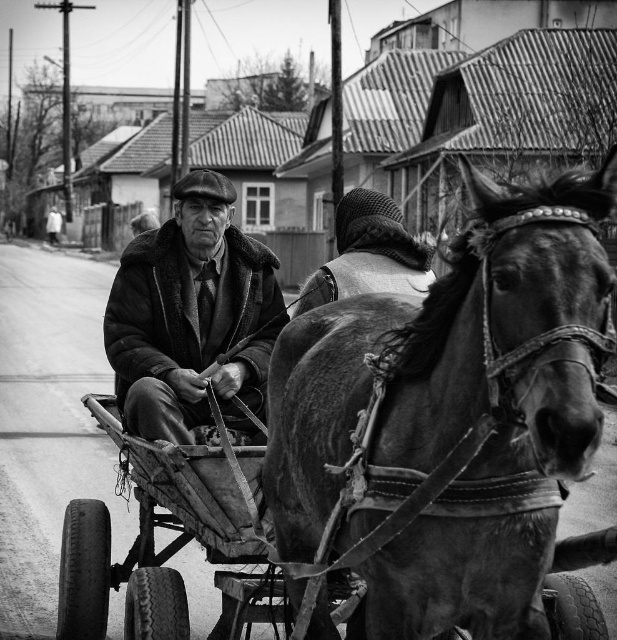
Question: Which point is closer to the camera?

Choices:
 (A) shiny dark brown horse at center
 (B) wooden cart at center
 (C) fur-lined coat at center

Answer: (A)

Question: Is wooden cart at center to the right of fur-lined coat at center from the viewer's perspective?

Choices:
 (A) yes
 (B) no

Answer: (B)

Question: Among these objects, which one is nearest to the camera?

Choices:
 (A) fur-lined coat at center
 (B) shiny dark brown horse at center
 (C) wooden cart at center

Answer: (B)

Question: Does wooden cart at center have a larger size compared to fur-lined coat at center?

Choices:
 (A) no
 (B) yes

Answer: (B)

Question: Among these points, which one is nearest to the camera?

Choices:
 (A) (465, 472)
 (B) (278, 609)
 (C) (123, 264)

Answer: (A)

Question: Does wooden cart at center have a lesser width compared to fur-lined coat at center?

Choices:
 (A) yes
 (B) no

Answer: (B)